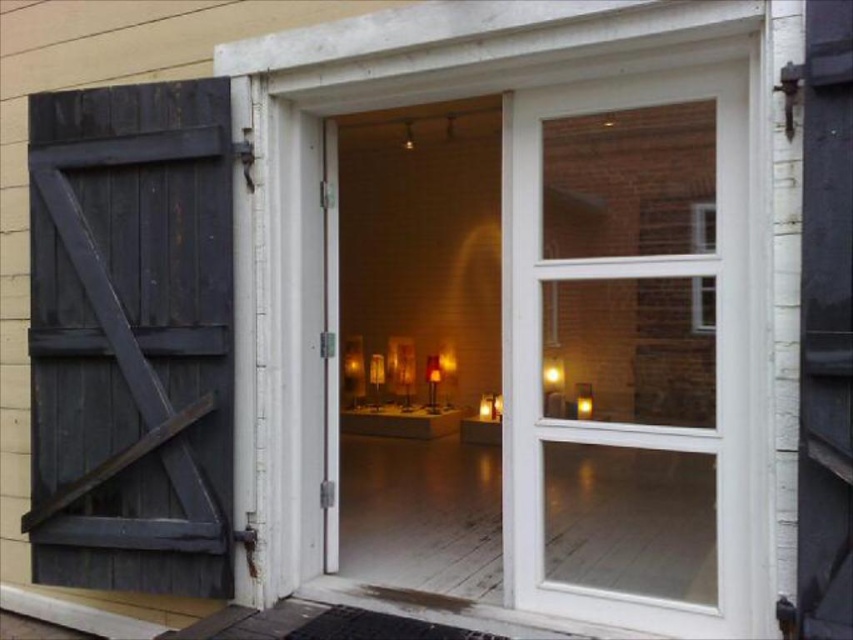
You are an art curator entering the building and need to access the gallery inside. The clear glass door at center and the dark wood barn door at left are both in your path. Which door should you go through to enter the gallery?

You should go through the clear glass door at center because it is positioned under the dark wood barn door at left, indicating it is the open entrance to the gallery.

You are a delivery person with a large package that is 1.8 meters long. You need to bring it through the doorway into the building. The clear glass door at center and dark wood barn door at left are both open. Can you fit your package through the space between them?

The clear glass door at center is 1.65 meters from the dark wood barn door at left. Since the package is 1.8 meters long, it is longer than the available space between the doors, so the package cannot fit through the gap between the clear glass door at center and the dark wood barn door at left.

You are standing outside the building and looking at the doorway. There are two points marked on the door frame and shutters. The first point is at coordinate point (546, 236) and the second is at point (701, 300). Which of these points is closer to your eyes?

Point (546, 236) is further to the camera than point (701, 300), so the point closer to your eyes is point (701, 300).